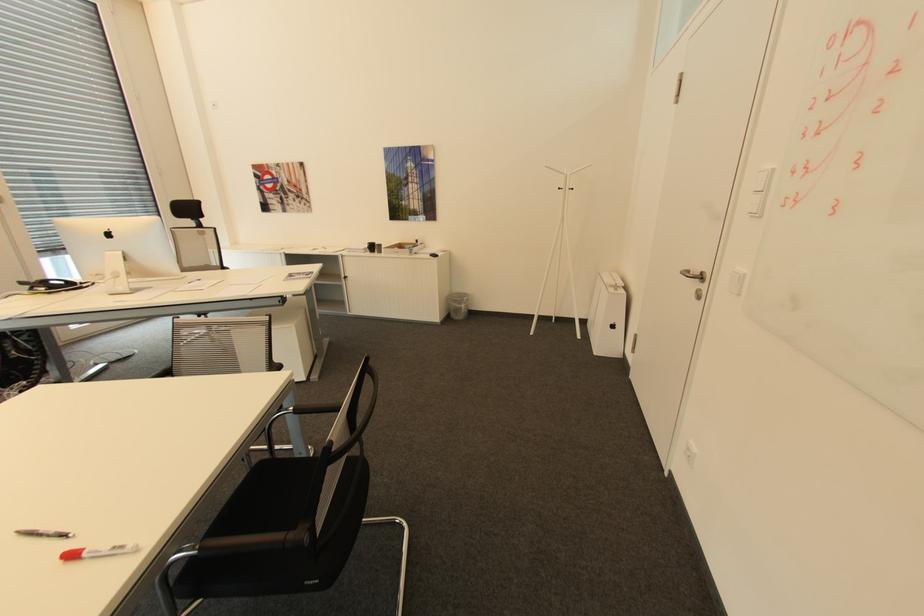
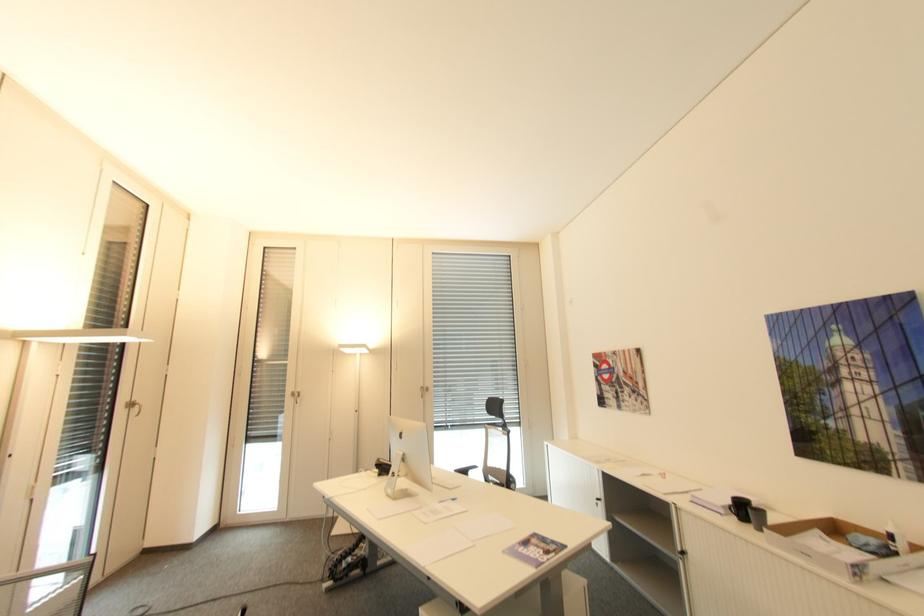
Find the pixel in the second image that matches the point at 371,245 in the first image.

(734, 501)